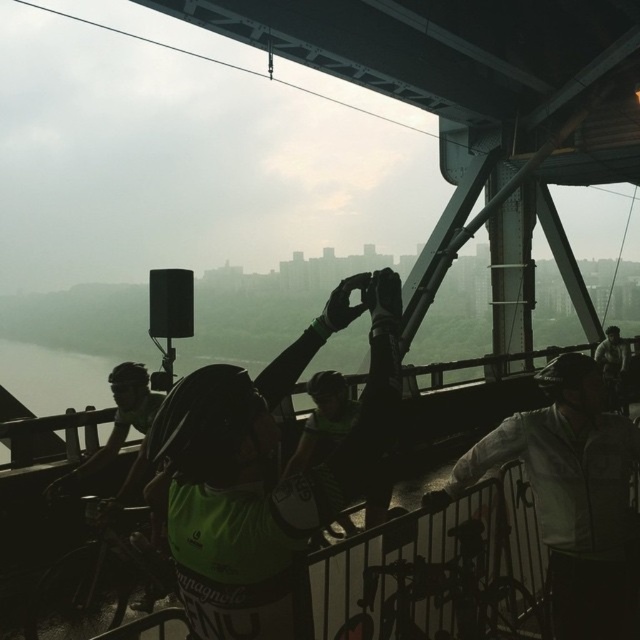
This screenshot has width=640, height=640. What are the coordinates of `transparent water at center` in the screenshot? It's located at (52, 378).

Describe the element at coordinates (52, 378) in the screenshot. I see `transparent water at center` at that location.

Is point (24, 390) behind point (604, 336)?

That is False.

Image resolution: width=640 pixels, height=640 pixels. Find the location of `transparent water at center`. transparent water at center is located at coordinates (52, 378).

Does white matte jacket at center appear on the left side of green reflective jersey at center?

Yes, white matte jacket at center is to the left of green reflective jersey at center.

Is white matte jacket at center thinner than green reflective jersey at center?

In fact, white matte jacket at center might be wider than green reflective jersey at center.

What do you see at coordinates (572, 496) in the screenshot? Image resolution: width=640 pixels, height=640 pixels. I see `white matte jacket at center` at bounding box center [572, 496].

Where is `white matte jacket at center`? white matte jacket at center is located at coordinates (572, 496).

Is point (577, 442) closer to viewer compared to point (97, 371)?

Yes, it is.

The width and height of the screenshot is (640, 640). What do you see at coordinates (572, 496) in the screenshot?
I see `white matte jacket at center` at bounding box center [572, 496].

The width and height of the screenshot is (640, 640). I want to click on white matte jacket at center, so click(572, 496).

The width and height of the screenshot is (640, 640). I want to click on white matte jacket at center, so click(572, 496).